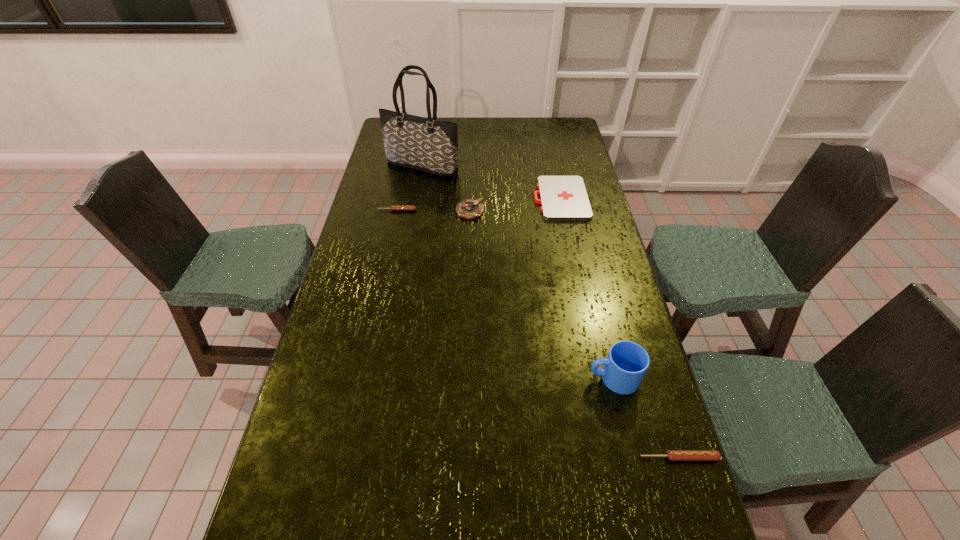
Locate an element on the screen. The image size is (960, 540). vacant space located on the back of the shorter sausage is located at coordinates (406, 167).

In order to click on free spot located 0.320m on the left of the taller sausage in this screenshot , I will do `click(505, 457)`.

I want to click on vacant region located on the right of the fourth shortest object, so click(x=583, y=211).

At what (x,y) coordinates should I click in order to perform the action: click on free space located on the right of the tallest object. Please return your answer as a coordinate pair (x, y). This screenshot has height=540, width=960. Looking at the image, I should click on (483, 167).

Image resolution: width=960 pixels, height=540 pixels. I want to click on free location located on handle side the shortest object, so click(x=502, y=199).

Find the location of a particular element. vacant area situated 0.350m on handle side the shortest object is located at coordinates (447, 199).

The width and height of the screenshot is (960, 540). I want to click on free space located on handle side the shortest object, so click(x=449, y=199).

Identify the location of free point located on the side of the mug with the handle. (489, 378).

In order to click on free spot located on the side of the mug with the handle in this screenshot , I will do `click(451, 378)`.

Find the location of a particular element. vacant space located 0.170m on the side of the mug with the handle is located at coordinates (525, 378).